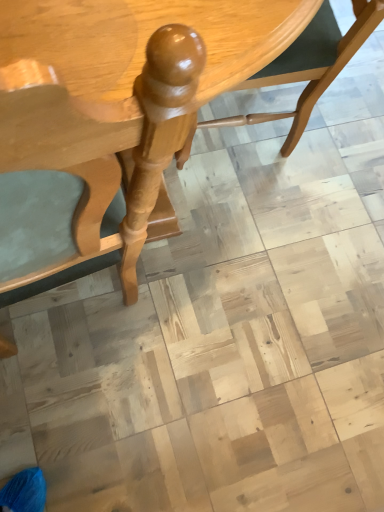
Describe the element at coordinates (310, 65) in the screenshot. I see `glossy wood chair at center` at that location.

In order to face glossy wood chair at center, should I rotate leftwards or rightwards?

Rotate right and turn 8.670 degrees.

Where is `glossy wood chair at center`? glossy wood chair at center is located at coordinates (310, 65).

At what (x,y) coordinates should I click in order to perform the action: click on glossy wood table at center. Please return your answer as a coordinate pair (x, y). Looking at the image, I should click on (110, 122).

Describe the element at coordinates (110, 122) in the screenshot. The height and width of the screenshot is (512, 384). I see `glossy wood table at center` at that location.

Identify the location of glossy wood chair at center. (310, 65).

Considering the positions of objects glossy wood table at center and glossy wood chair at center in the image provided, who is more to the right, glossy wood table at center or glossy wood chair at center?

glossy wood chair at center.

Which object is closer to the camera taking this photo, glossy wood table at center or glossy wood chair at center?

glossy wood table at center.

Does point (55, 238) come closer to viewer compared to point (307, 59)?

Yes, it is.

From the image's perspective, between glossy wood table at center and glossy wood chair at center, which one is located above?

glossy wood chair at center is shown above in the image.

From a real-world perspective, is glossy wood table at center positioned above or below glossy wood chair at center?

glossy wood table at center is situated higher than glossy wood chair at center in the real world.

In the scene shown: Considering the relative sizes of glossy wood table at center and glossy wood chair at center in the image provided, is glossy wood table at center thinner than glossy wood chair at center?

Incorrect, the width of glossy wood table at center is not less than that of glossy wood chair at center.

Who is taller, glossy wood table at center or glossy wood chair at center?

With more height is glossy wood table at center.

Between glossy wood table at center and glossy wood chair at center, which one has larger size?

With larger size is glossy wood table at center.

Is glossy wood table at center not within glossy wood chair at center?

Absolutely, glossy wood table at center is external to glossy wood chair at center.

Are glossy wood table at center and glossy wood chair at center located far from each other?

No, glossy wood table at center is in close proximity to glossy wood chair at center.

Could you tell me if glossy wood table at center is facing glossy wood chair at center?

No, glossy wood table at center is not aimed at glossy wood chair at center.

Can you tell me how much glossy wood table at center and glossy wood chair at center differ in facing direction?

The angle between the facing direction of glossy wood table at center and the facing direction of glossy wood chair at center is 83.2 degrees.

Find the location of a particular element. The width and height of the screenshot is (384, 512). chair directly beneath the glossy wood table at center (from a real-world perspective) is located at coordinates (310, 65).

Considering the positions of objects glossy wood chair at center and glossy wood table at center in the image provided, who is more to the right, glossy wood chair at center or glossy wood table at center?

From the viewer's perspective, glossy wood chair at center appears more on the right side.

Which object is more forward, glossy wood chair at center or glossy wood table at center?

glossy wood table at center is more forward.

Considering the positions of points (326, 62) and (28, 214), is point (326, 62) farther from camera compared to point (28, 214)?

Yes, point (326, 62) is behind point (28, 214).

From the image's perspective, between glossy wood chair at center and glossy wood table at center, who is located below?

glossy wood table at center.

From a real-world perspective, who is located higher, glossy wood chair at center or glossy wood table at center?

From a 3D spatial view, glossy wood table at center is above.

Can you confirm if glossy wood chair at center is thinner than glossy wood table at center?

Indeed, glossy wood chair at center has a lesser width compared to glossy wood table at center.

Which of these two, glossy wood chair at center or glossy wood table at center, stands shorter?

Standing shorter between the two is glossy wood chair at center.

Considering the relative sizes of glossy wood chair at center and glossy wood table at center in the image provided, is glossy wood chair at center bigger than glossy wood table at center?

No, glossy wood chair at center is not bigger than glossy wood table at center.

Would you say glossy wood chair at center is outside glossy wood table at center?

That's incorrect, glossy wood chair at center is not completely outside glossy wood table at center.

Is glossy wood chair at center far from glossy wood table at center?

glossy wood chair at center is near glossy wood table at center, not far away.

Could you tell me if glossy wood chair at center is turned towards glossy wood table at center?

Yes, glossy wood chair at center is aimed at glossy wood table at center.

How different are the orientations of glossy wood chair at center and glossy wood table at center in degrees?

glossy wood chair at center and glossy wood table at center are facing 83.2 degrees away from each other.

How far apart are glossy wood chair at center and glossy wood table at center?

glossy wood chair at center is 57.04 centimeters away from glossy wood table at center.

The image size is (384, 512). I want to click on chair behind the glossy wood table at center, so click(310, 65).

In order to click on table on the left of glossy wood chair at center in this screenshot , I will do `click(110, 122)`.

You are a GUI agent. You are given a task and a screenshot of the screen. Output one action in this format:
    pyautogui.click(x=<x>, y=<y>)
    Task: Click on the table below the glossy wood chair at center (from the image's perspective)
    
    Given the screenshot: What is the action you would take?
    pyautogui.click(x=110, y=122)